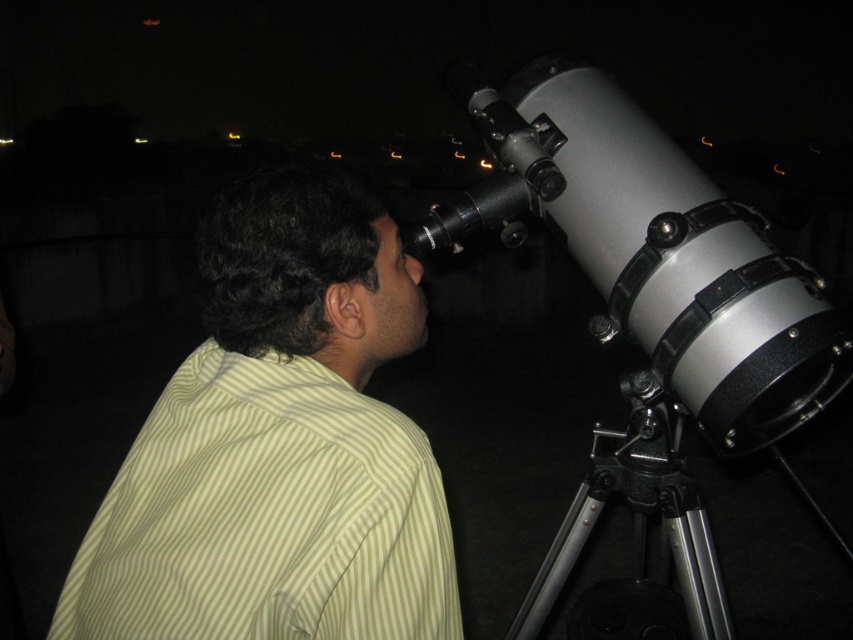
Looking at this image, you are a photographer trying to capture a clear image of the telescope. You need to ensure that both the light yellow striped shirt at center and the silver metallic telescope at right are in focus. Given that your camera has a depth of field of 20 inches, will both objects be in focus?

The light yellow striped shirt at center is 23.73 inches away from the silver metallic telescope at right. Since the distance between them exceeds the camera depth of field of 20 inches, the two objects cannot both be in focus at the same time.

You are standing in front of a telescope and see a person wearing a light yellow striped shirt at center. The telescope has a 22 inch aperture. Can you fit between the person and the telescope to adjust the tripod?

The distance between the light yellow striped shirt at center and the viewer is 21.88 inches. Since the telescope has a 22 inch aperture, you can barely fit between the person and the telescope to adjust the tripod.

You are standing in the same position as the person in the image and want to determine which of the two points, point (x=227, y=451) or point (x=751, y=337), is closer to you. Based on the scene, which point is nearer?

Point (x=227, y=451) is closer to the viewer than point (x=751, y=337).